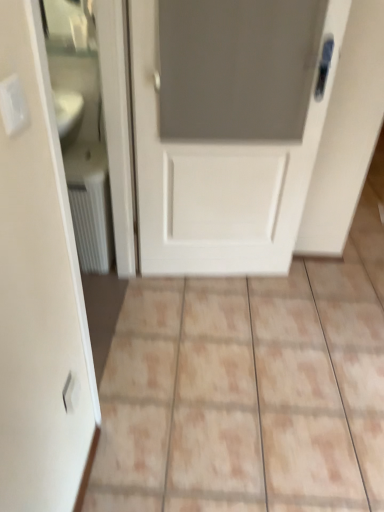
Locate an element on the screen. free space in front of white matte door at center is located at coordinates (225, 335).